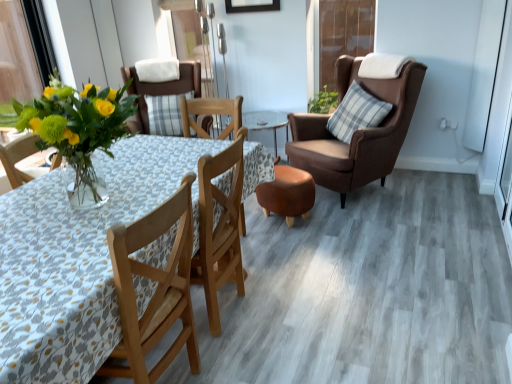
Question: Considering the positions of point (128, 74) and point (369, 49), is point (128, 74) closer or farther from the camera than point (369, 49)?

Choices:
 (A) farther
 (B) closer

Answer: (B)

Question: Visually, is matte brown chair at center, which is counted as the first chair, starting from the left, positioned to the left or to the right of transparent plastic screen door at upper center?

Choices:
 (A) right
 (B) left

Answer: (B)

Question: Which object is positioned farthest from the transparent plastic screen door at upper center?

Choices:
 (A) matte brown chair at center, which is counted as the first chair, starting from the left
 (B) matte glass vase with yellow flowers at left
 (C) wooden floral-patterned table at center
 (D) brown leather chair at right, which ranks as the second chair in left-to-right order
 (E) plaid fabric pillow at right

Answer: (B)

Question: Based on their relative distances, which object is nearer to the wooden floral-patterned table at center?

Choices:
 (A) matte brown chair at center, the 2th chair when ordered from right to left
 (B) matte glass vase with yellow flowers at left
 (C) transparent plastic screen door at upper center
 (D) plaid fabric pillow at right
 (E) brown leather chair at right, placed as the first chair when sorted from right to left

Answer: (B)